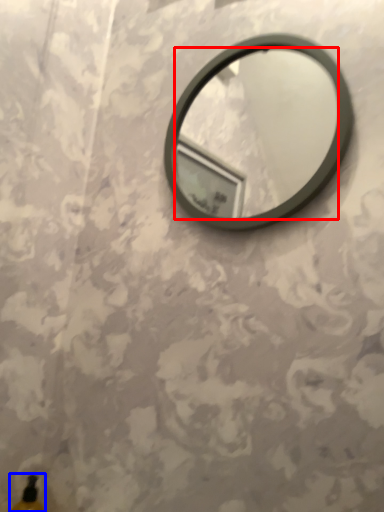
Question: Which of the following is the farthest to the observer, mirror (highlighted by a red box) or bottle (highlighted by a blue box)?

Choices:
 (A) mirror
 (B) bottle

Answer: (B)